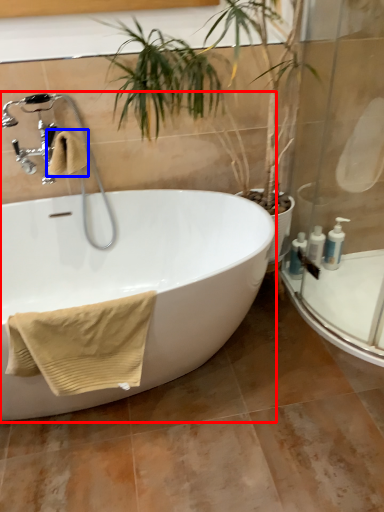
Question: Which of the following is the farthest to the observer, bathtub (highlighted by a red box) or bath towel (highlighted by a blue box)?

Choices:
 (A) bathtub
 (B) bath towel

Answer: (B)